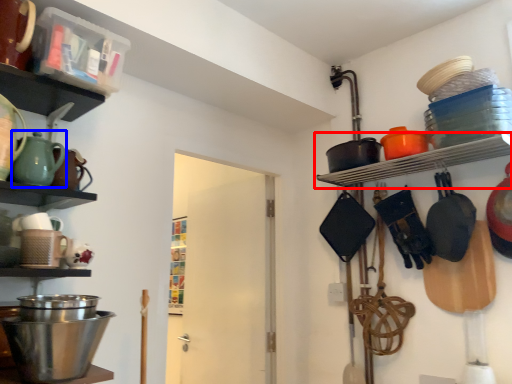
Question: Which point is further to the camera, shelf (highlighted by a red box) or tea pot (highlighted by a blue box)?

Choices:
 (A) shelf
 (B) tea pot

Answer: (A)